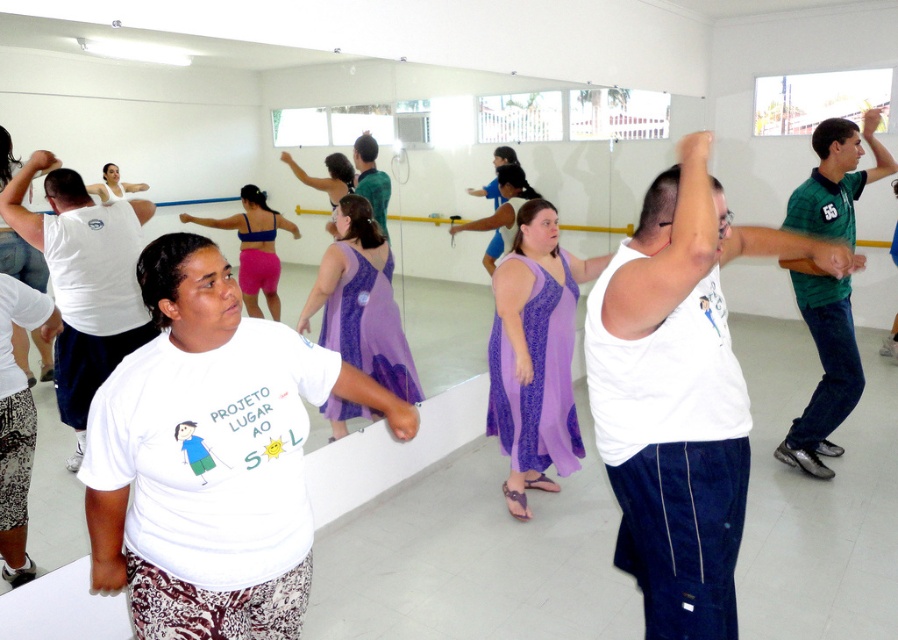
Question: Considering the real-world distances, which object is closest to the matte purple dress at center?

Choices:
 (A) purple sheer dress at center
 (B) purple satin dress at center
 (C) white cotton t-shirt at center
 (D) white tank top at center

Answer: (A)

Question: Which point appears farthest from the camera in this image?

Choices:
 (A) (313, 305)
 (B) (125, 192)

Answer: (A)

Question: Does white cotton t-shirt at center appear on the left side of white tank top at center?

Choices:
 (A) yes
 (B) no

Answer: (A)

Question: Which point is closer to the camera?

Choices:
 (A) purple satin dress at center
 (B) white tank top at center

Answer: (B)

Question: In this image, where is matte purple dress at center located relative to white fabric at upper center?

Choices:
 (A) below
 (B) above

Answer: (A)

Question: Can you confirm if purple sheer dress at center is wider than matte purple dress at center?

Choices:
 (A) yes
 (B) no

Answer: (A)